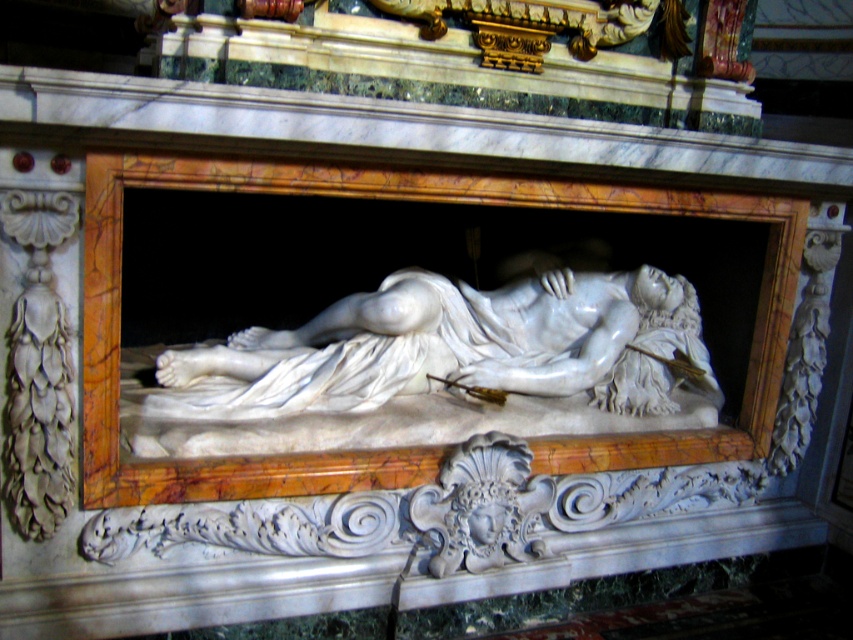
Question: Is white marble statue at center above white marble mask at center?

Choices:
 (A) no
 (B) yes

Answer: (B)

Question: Observing the image, what is the correct spatial positioning of white marble statue at center in reference to white marble mask at center?

Choices:
 (A) below
 (B) above

Answer: (B)

Question: Which point is farther to the camera?

Choices:
 (A) click(416, 304)
 (B) click(514, 465)

Answer: (B)

Question: Can you confirm if white marble statue at center is positioned to the left of white marble mask at center?

Choices:
 (A) yes
 (B) no

Answer: (A)

Question: Among these objects, which one is farthest from the camera?

Choices:
 (A) white marble mask at center
 (B) white marble statue at center

Answer: (A)

Question: Which object is closer to the camera taking this photo?

Choices:
 (A) white marble statue at center
 (B) white marble mask at center

Answer: (A)